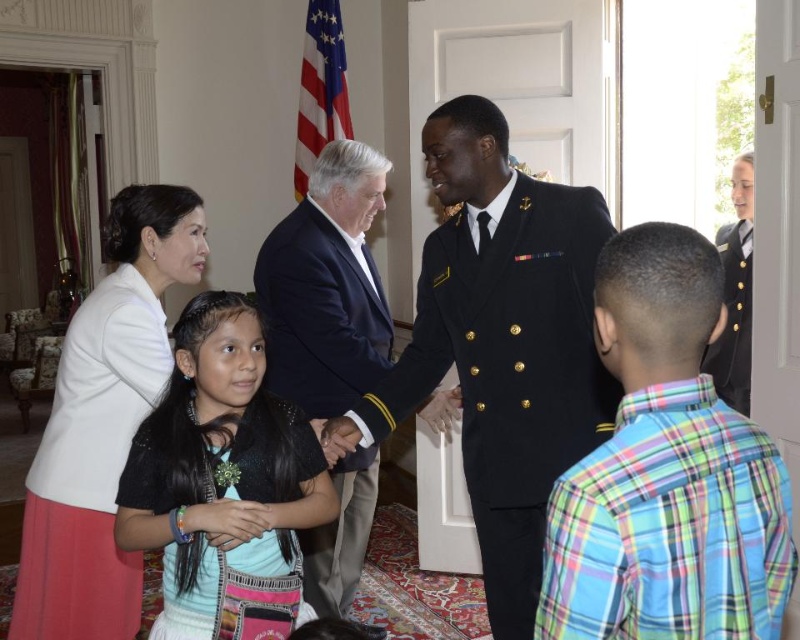
Can you confirm if black textured dress at center is thinner than dark blue suit at center?

Yes, black textured dress at center is thinner than dark blue suit at center.

Can you confirm if black textured dress at center is taller than dark blue suit at center?

In fact, black textured dress at center may be shorter than dark blue suit at center.

What are the coordinates of `black textured dress at center` in the screenshot? It's located at (220, 468).

Does black textured dress at center appear over white matte blazer at left?

No.

From the picture: Is black textured dress at center positioned in front of white matte blazer at left?

Yes.

Is point (252, 317) in front of point (61, 369)?

That is True.

I want to click on black textured dress at center, so click(x=220, y=468).

What are the coordinates of `plaid cotton shirt at lower right` in the screenshot? It's located at (670, 525).

Which is behind, point (666, 596) or point (42, 445)?

The point (42, 445) is more distant.

Between point (764, 577) and point (122, 301), which one is positioned behind?

The point (122, 301) is more distant.

Find the location of a particular element. plaid cotton shirt at lower right is located at coordinates (670, 525).